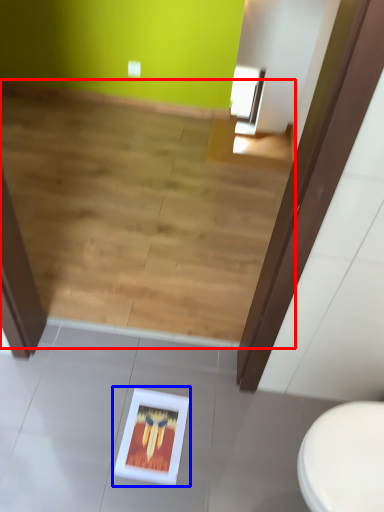
Question: Which object is further to the camera taking this photo, stairwell (highlighted by a red box) or picture frame (highlighted by a blue box)?

Choices:
 (A) stairwell
 (B) picture frame

Answer: (A)